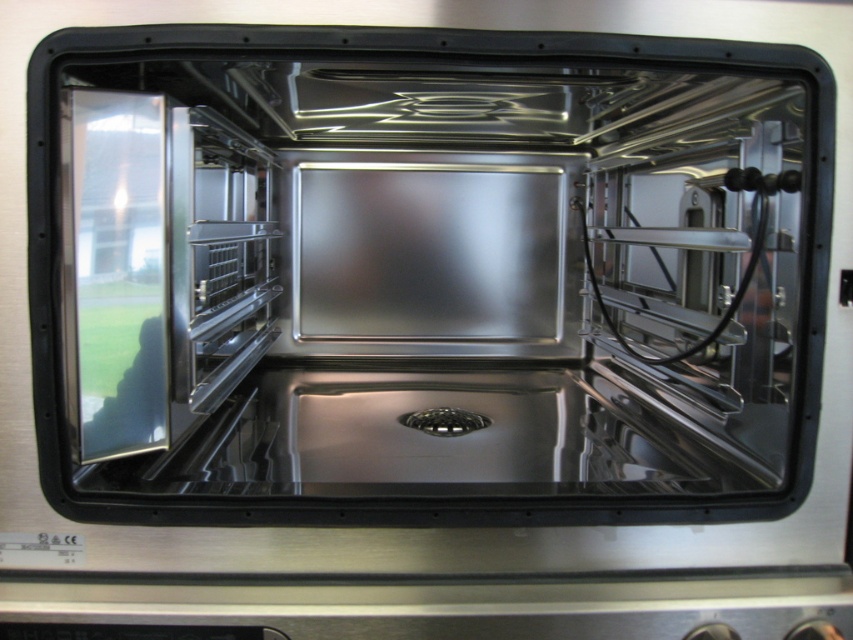
Question: Among these objects, which one is farthest from the camera?

Choices:
 (A) polished stainless steel exhaust hood at center
 (B) stainless steel oven at center

Answer: (A)

Question: Is transparent glass door at left positioned before polished stainless steel exhaust hood at center?

Choices:
 (A) no
 (B) yes

Answer: (A)

Question: Based on their relative distances, which object is farther from the polished stainless steel exhaust hood at center?

Choices:
 (A) stainless steel oven at center
 (B) transparent glass door at left

Answer: (B)

Question: Can you confirm if stainless steel oven at center is positioned to the left of polished stainless steel exhaust hood at center?

Choices:
 (A) yes
 (B) no

Answer: (A)

Question: Which object is the farthest from the stainless steel oven at center?

Choices:
 (A) transparent glass door at left
 (B) polished stainless steel exhaust hood at center

Answer: (A)

Question: Is transparent glass door at left in front of polished stainless steel exhaust hood at center?

Choices:
 (A) yes
 (B) no

Answer: (B)